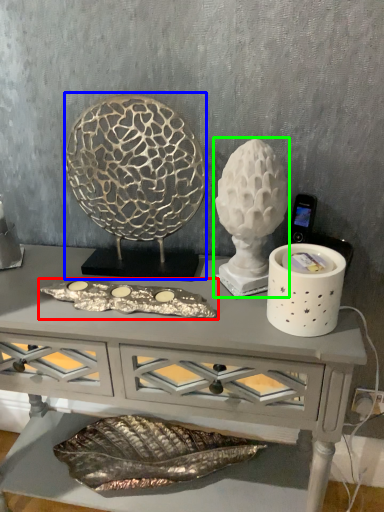
Question: Which is farther away from art (highlighted by a red box)? sculpture (highlighted by a blue box) or sculpture (highlighted by a green box)?

Choices:
 (A) sculpture
 (B) sculpture

Answer: (A)